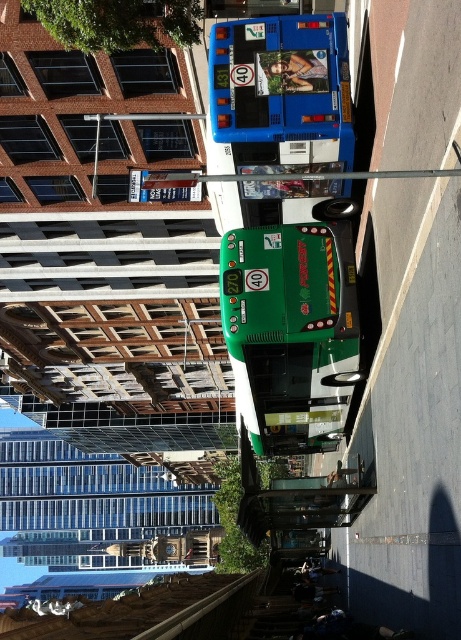
Question: Is green matte bus at center positioned before blue metallic bus at upper center?

Choices:
 (A) no
 (B) yes

Answer: (A)

Question: Which point is farther from the camera taking this photo?

Choices:
 (A) (297, 426)
 (B) (317, 29)

Answer: (A)

Question: Does green matte bus at center appear on the left side of blue metallic bus at upper center?

Choices:
 (A) no
 (B) yes

Answer: (B)

Question: Which of the following is the closest to the observer?

Choices:
 (A) blue metallic bus at upper center
 (B) green matte bus at center

Answer: (A)

Question: Which object appears farthest from the camera in this image?

Choices:
 (A) green matte bus at center
 (B) blue metallic bus at upper center

Answer: (A)

Question: Is green matte bus at center to the right of blue metallic bus at upper center from the viewer's perspective?

Choices:
 (A) no
 (B) yes

Answer: (A)